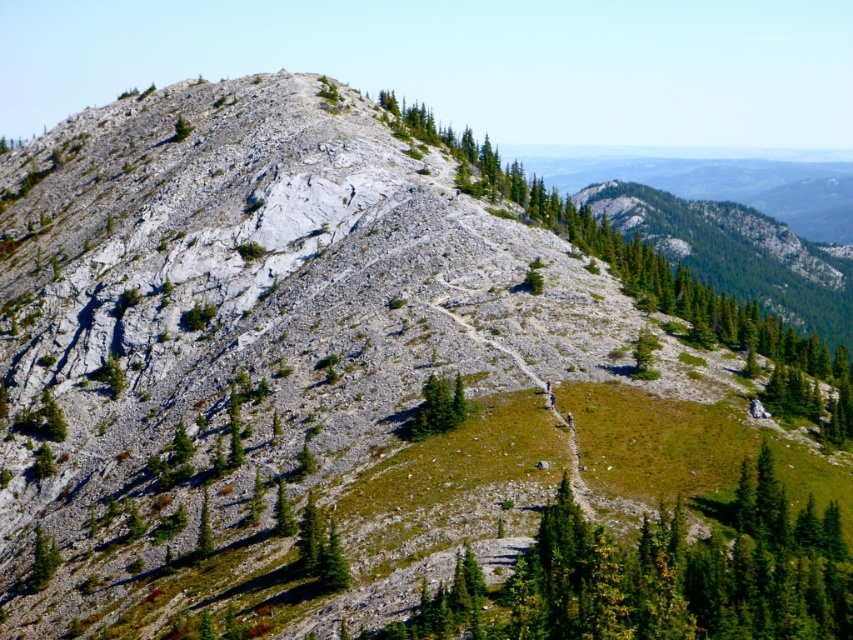
You are a hiker standing at the bottom of the mountain looking up. You see a green coniferous tree at center and a green leafy tree at center. Which tree is positioned more to the left side of the image?

The green coniferous tree at center is positioned to the left of the green leafy tree at center, so the green coniferous tree at center is more to the left side of the image.

You are a hiker standing on the path and want to take a photo of both the green coniferous tree at center and the green leafy tree at center. Which tree should you focus on first to ensure both are in frame?

The green coniferous tree at center is positioned under the green leafy tree at center, so you should focus on the green leafy tree at center first to ensure both are in frame.